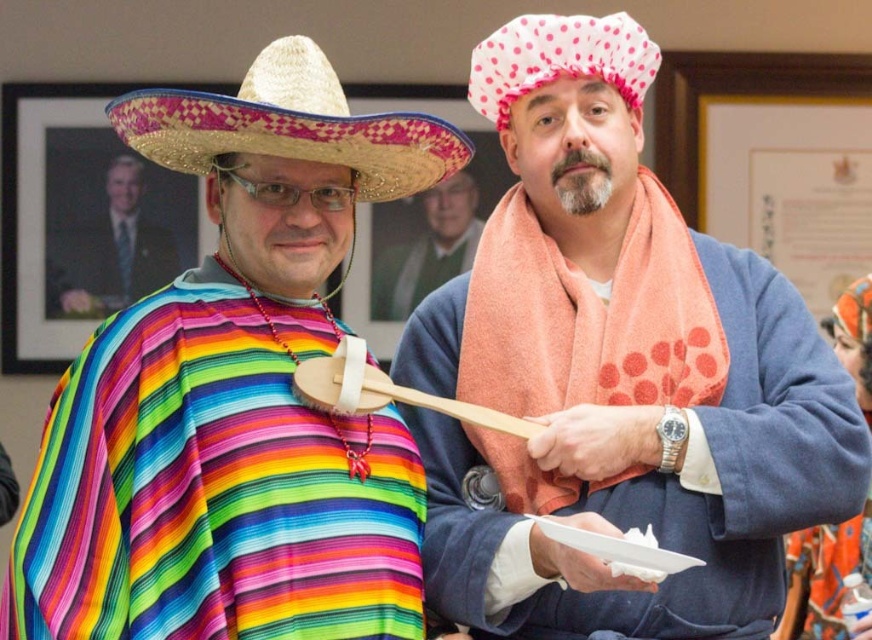
You are standing in front of the two people in the image. The orange towel at right is located at point (771,420). Can you determine if the orange towel at right is closer to the person on the left or the person on the right?

The orange towel at right is located at point (771,420). Since the person on the right is wearing the orange towel, it is closer to them.

You are a photographer trying to capture a closeup of the rainbow fabric poncho at left and the bright straw sombrero at left. Which object should you zoom in on more to ensure both are in focus?

The rainbow fabric poncho at left might be wider than bright straw sombrero at left, so you should zoom in more on the bright straw sombrero at left to ensure both are in focus.

You are a photographer standing at the center of the scene. You want to take a photo that includes both the rainbow fabric poncho at left and the pink polka dot fabric at upper center. Given that your camera has a maximum zoom range of 2 meters, will you be able to capture both objects in a single frame without moving closer?

The distance between the rainbow fabric poncho at left and the pink polka dot fabric at upper center is 3.38 meters. Since the camera can only zoom up to 2 meters, you will not be able to capture both objects in a single frame without moving closer.